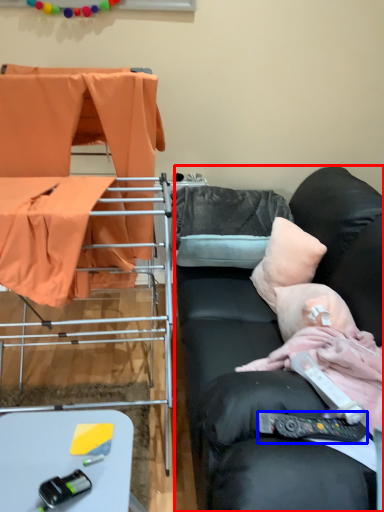
Question: Which of the following is the closest to the observer, studio couch (highlighted by a red box) or remote control (highlighted by a blue box)?

Choices:
 (A) studio couch
 (B) remote control

Answer: (A)